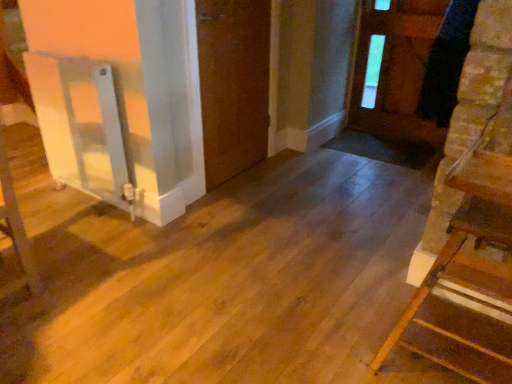
I want to click on vacant point to the right of brown matte door at center, which is the 1th door from left to right, so click(297, 170).